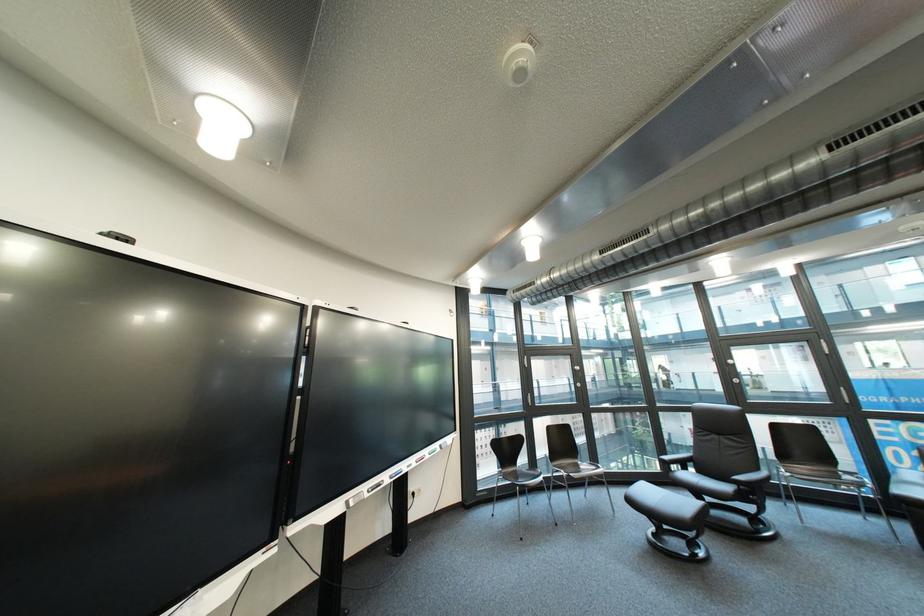
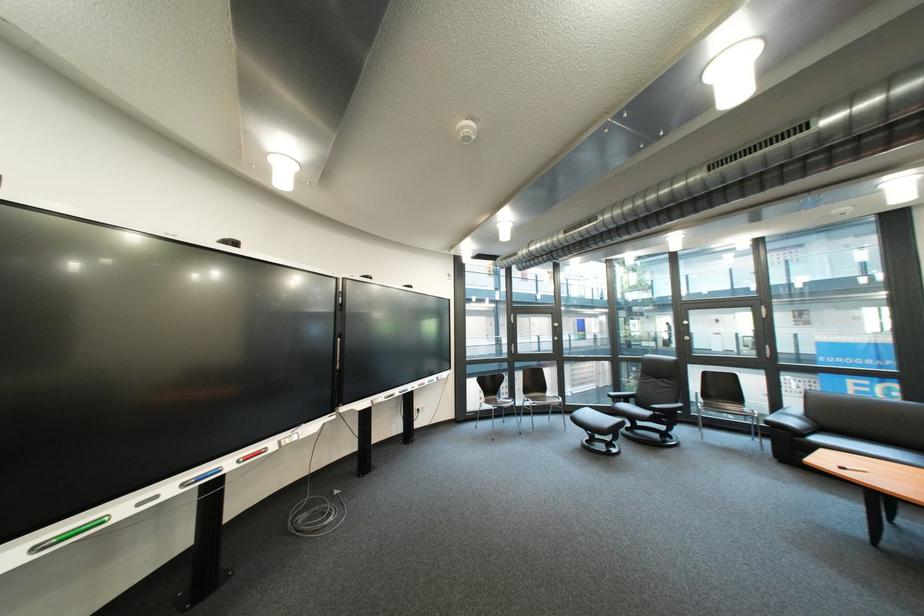
Find the pixel in the second image that matches (x=667, y=537) in the first image.

(601, 443)